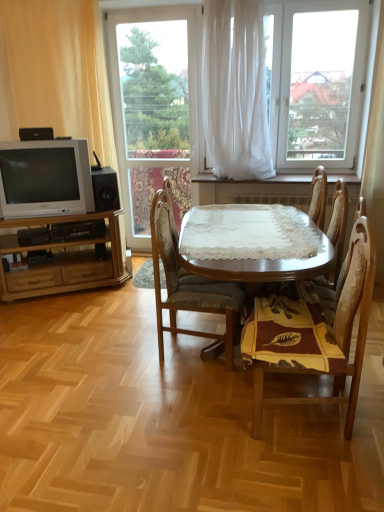
Question: In which direction should I rotate to look at transparent glass window at center, arranged as the 1th window when viewed from the left?

Choices:
 (A) left
 (B) right

Answer: (A)

Question: Is white sheer curtain at upper left, which is the second curtain from right to left, touching black matte speaker at lower left, the first loudspeaker in the back-to-front sequence?

Choices:
 (A) yes
 (B) no

Answer: (B)

Question: Is white sheer curtain at upper left, the 1th curtain in the left-to-right sequence, taller than black matte speaker at lower left, placed as the second loudspeaker when sorted from front to back?

Choices:
 (A) no
 (B) yes

Answer: (B)

Question: Is white sheer curtain at upper left, which is the second curtain from right to left, behind black matte speaker at lower left, which ranks as the first loudspeaker in bottom-to-top order?

Choices:
 (A) no
 (B) yes

Answer: (A)

Question: Is white sheer curtain at upper left, which is the second curtain from right to left, far away from black matte speaker at lower left, which appears as the first loudspeaker when viewed from the right?

Choices:
 (A) no
 (B) yes

Answer: (A)

Question: Does white sheer curtain at upper left, which is the second curtain from right to left, turn towards black matte speaker at lower left, the first loudspeaker in the back-to-front sequence?

Choices:
 (A) yes
 (B) no

Answer: (A)

Question: From a real-world perspective, is white sheer curtain at upper left, the 1th curtain in the left-to-right sequence, located higher than black matte speaker at lower left, which ranks as the first loudspeaker in bottom-to-top order?

Choices:
 (A) no
 (B) yes

Answer: (B)

Question: From a real-world perspective, is light brown wood entertainment center at left located higher than matte silver television at left?

Choices:
 (A) no
 (B) yes

Answer: (A)

Question: Can you confirm if light brown wood entertainment center at left is positioned to the left of matte silver television at left?

Choices:
 (A) yes
 (B) no

Answer: (B)

Question: Does light brown wood entertainment center at left have a greater height compared to matte silver television at left?

Choices:
 (A) no
 (B) yes

Answer: (B)

Question: From the image's perspective, is light brown wood entertainment center at left on top of matte silver television at left?

Choices:
 (A) yes
 (B) no

Answer: (B)

Question: Does light brown wood entertainment center at left have a lesser width compared to matte silver television at left?

Choices:
 (A) yes
 (B) no

Answer: (B)

Question: Considering the relative sizes of light brown wood entertainment center at left and matte silver television at left in the image provided, is light brown wood entertainment center at left wider than matte silver television at left?

Choices:
 (A) no
 (B) yes

Answer: (B)

Question: From a real-world perspective, is black matte speaker at lower left, which is the second loudspeaker in left-to-right order, on wooden chair at center, which is the 1th chair from right to left?

Choices:
 (A) no
 (B) yes

Answer: (B)